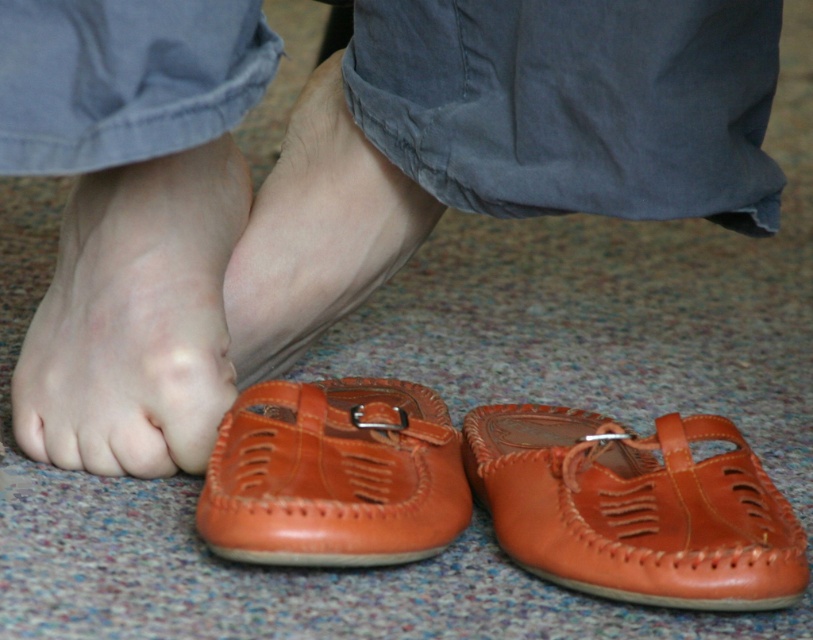
Can you confirm if brown leather shoe at lower right is taller than brown leather shoe at lower center?

Incorrect, brown leather shoe at lower right's height is not larger of brown leather shoe at lower center's.

Is the position of brown leather shoe at lower right less distant than that of brown leather shoe at lower center?

Yes, it is in front of brown leather shoe at lower center.

Does point (767, 484) lie behind point (238, 516)?

Yes, it is.

The image size is (813, 640). I want to click on brown leather shoe at lower right, so pyautogui.click(x=635, y=508).

Is brown leather shoe at lower right below leather at center?

Correct, brown leather shoe at lower right is located below leather at center.

Between point (518, 419) and point (331, 81), which one is positioned in front?

Positioned in front is point (518, 419).

Identify the location of brown leather shoe at lower right. (635, 508).

Does matte orange leather foot at lower left appear over leather at center?

Incorrect, matte orange leather foot at lower left is not positioned above leather at center.

Which is in front, point (153, 220) or point (389, 179)?

Positioned in front is point (153, 220).

The image size is (813, 640). Describe the element at coordinates (137, 317) in the screenshot. I see `matte orange leather foot at lower left` at that location.

At what (x,y) coordinates should I click in order to perform the action: click on matte orange leather foot at lower left. Please return your answer as a coordinate pair (x, y). The image size is (813, 640). Looking at the image, I should click on (137, 317).